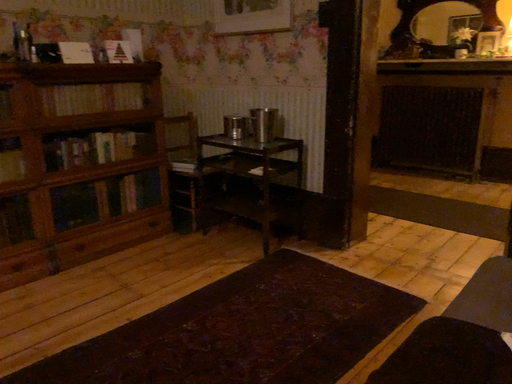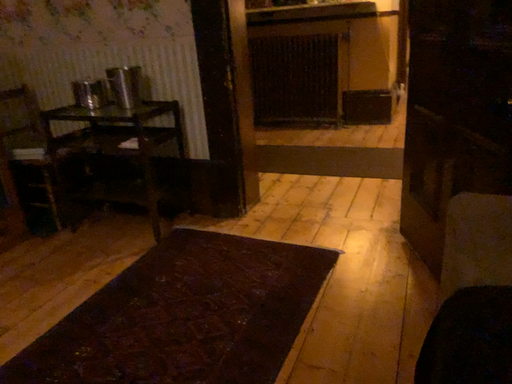
Question: Which way did the camera rotate in the video?

Choices:
 (A) rotated right
 (B) rotated left

Answer: (A)